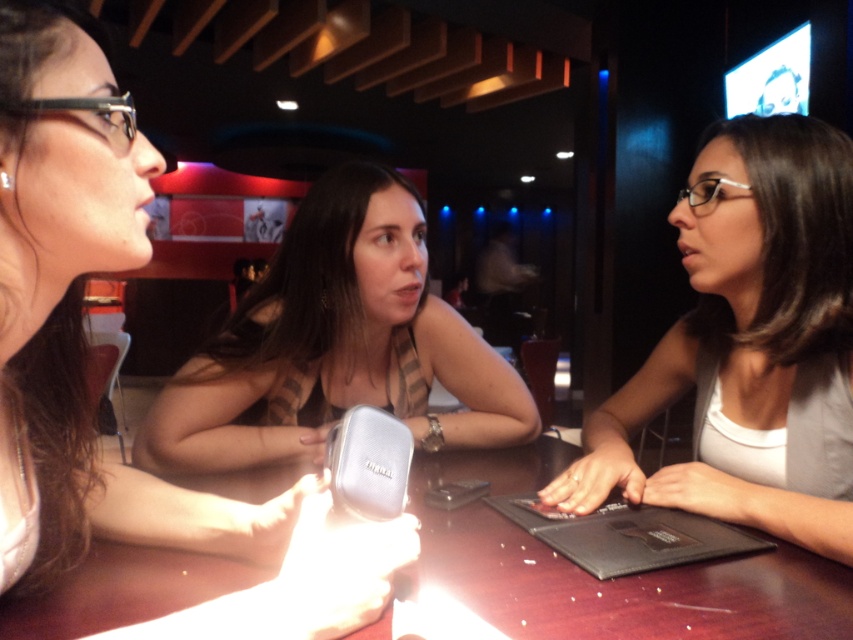
Between matte black laptop at center and brown textured tank top at center, which one appears on the left side from the viewer's perspective?

matte black laptop at center

Can you confirm if matte black laptop at center is shorter than brown textured tank top at center?

In fact, matte black laptop at center may be taller than brown textured tank top at center.

Does point (49, 28) come in front of point (439, 416)?

Yes, point (49, 28) is closer to viewer.

The height and width of the screenshot is (640, 853). What are the coordinates of `matte black laptop at center` in the screenshot? It's located at [x=78, y=314].

At what (x,y) coordinates should I click in order to perform the action: click on brown textured tank top at center. Please return your answer as a coordinate pair (x, y). This screenshot has width=853, height=640. Looking at the image, I should click on (335, 344).

Is brown textured tank top at center shorter than black matte laptop at center?

No, brown textured tank top at center is not shorter than black matte laptop at center.

Which is behind, point (277, 432) or point (527, 515)?

The point (277, 432) is behind.

What are the coordinates of `brown textured tank top at center` in the screenshot? It's located at 335,344.

From the picture: Who is more distant from viewer, (213, 516) or (788, 232)?

Positioned behind is point (788, 232).

Who is taller, matte black laptop at center or matte gray laptop at center?

Standing taller between the two is matte gray laptop at center.

Describe the element at coordinates (78, 314) in the screenshot. The height and width of the screenshot is (640, 853). I see `matte black laptop at center` at that location.

You are a GUI agent. You are given a task and a screenshot of the screen. Output one action in this format:
    pyautogui.click(x=<x>, y=<y>)
    Task: Click on the matte black laptop at center
    This screenshot has height=640, width=853.
    Given the screenshot: What is the action you would take?
    pyautogui.click(x=78, y=314)